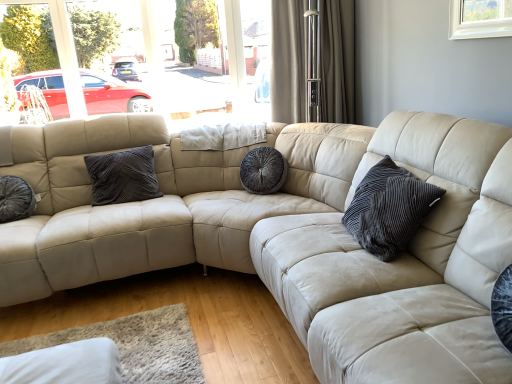
Question: Considering the relative positions of dark grey velvet pillow at center, which appears as the 3th pillow when viewed from the front, and velvet dark gray pillow at left, which appears as the 3th pillow when viewed from the right, in the image provided, is dark grey velvet pillow at center, which appears as the 3th pillow when viewed from the front, in front of velvet dark gray pillow at left, which appears as the 3th pillow when viewed from the right,?

Choices:
 (A) no
 (B) yes

Answer: (A)

Question: Does dark grey velvet pillow at center, arranged as the second pillow when viewed from the right, appear on the right side of velvet dark gray pillow at left, placed as the 2th pillow when sorted from back to front?

Choices:
 (A) no
 (B) yes

Answer: (B)

Question: Is dark grey velvet pillow at center, the second pillow when ordered from left to right, shorter than velvet dark gray pillow at left, which appears as the 3th pillow when viewed from the right?

Choices:
 (A) no
 (B) yes

Answer: (A)

Question: Can you confirm if dark grey velvet pillow at center, which appears as the 3th pillow when viewed from the front, is wider than velvet dark gray pillow at left, the 1th pillow viewed from the left?

Choices:
 (A) yes
 (B) no

Answer: (B)

Question: Is dark grey velvet pillow at center, which appears as the 3th pillow when viewed from the front, positioned behind velvet dark gray pillow at left, the 1th pillow viewed from the left?

Choices:
 (A) no
 (B) yes

Answer: (B)

Question: In terms of width, does velvet dark gray pillow at left, which appears as the 3th pillow when viewed from the right, look wider or thinner when compared to beige leather couch at center?

Choices:
 (A) thin
 (B) wide

Answer: (A)

Question: From the image's perspective, is velvet dark gray pillow at left, placed as the 2th pillow when sorted from back to front, positioned above or below beige leather couch at center?

Choices:
 (A) above
 (B) below

Answer: (A)

Question: Looking at the image, does velvet dark gray pillow at left, placed as the 2th pillow when sorted from back to front, seem bigger or smaller compared to beige leather couch at center?

Choices:
 (A) big
 (B) small

Answer: (B)

Question: In the image, is velvet dark gray pillow at left, which appears as the 3th pillow when viewed from the right, on the left side or the right side of beige leather couch at center?

Choices:
 (A) right
 (B) left

Answer: (B)

Question: Considering the positions of beige leather couch at center and dark grey velvet pillow at center, which appears as the 3th pillow when viewed from the front, in the image, is beige leather couch at center wider or thinner than dark grey velvet pillow at center, which appears as the 3th pillow when viewed from the front,?

Choices:
 (A) wide
 (B) thin

Answer: (A)

Question: Considering the positions of point (250, 147) and point (116, 177), is point (250, 147) closer or farther from the camera than point (116, 177)?

Choices:
 (A) closer
 (B) farther

Answer: (B)

Question: Is beige leather couch at center inside or outside of dark grey velvet pillow at center, arranged as the second pillow when viewed from the right?

Choices:
 (A) inside
 (B) outside

Answer: (B)

Question: From the image's perspective, is beige leather couch at center positioned above or below dark grey velvet pillow at center, arranged as the second pillow when viewed from the right?

Choices:
 (A) below
 (B) above

Answer: (A)

Question: From their relative heights in the image, would you say beige textured curtain at upper center is taller or shorter than velvet dark gray pillow at center, marked as the 3th pillow in a back-to-front arrangement?

Choices:
 (A) short
 (B) tall

Answer: (B)

Question: Is beige textured curtain at upper center wider or thinner than velvet dark gray pillow at center, which ranks as the 1th pillow in right-to-left order?

Choices:
 (A) thin
 (B) wide

Answer: (B)